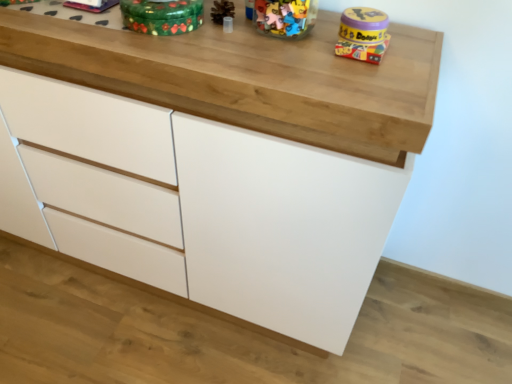
Question: Considering their positions, is green painted wood toy at upper center, acting as the 2th toy starting from the right, located in front of or behind matte yellow plastic toy at upper right, arranged as the 2th toy when viewed from the left?

Choices:
 (A) behind
 (B) front

Answer: (B)

Question: Does point (194, 4) appear closer or farther from the camera than point (359, 41)?

Choices:
 (A) closer
 (B) farther

Answer: (B)

Question: From the image's perspective, is green painted wood toy at upper center, which ranks as the first toy in left-to-right order, positioned above or below matte yellow plastic toy at upper right, the first toy when ordered from right to left?

Choices:
 (A) below
 (B) above

Answer: (B)

Question: Do you think matte yellow plastic toy at upper right, the first toy when ordered from right to left, is within green painted wood toy at upper center, acting as the 2th toy starting from the right, or outside of it?

Choices:
 (A) outside
 (B) inside

Answer: (A)

Question: Looking at their shapes, would you say matte yellow plastic toy at upper right, arranged as the 2th toy when viewed from the left, is wider or thinner than green painted wood toy at upper center, acting as the 2th toy starting from the right?

Choices:
 (A) thin
 (B) wide

Answer: (A)

Question: Does point (357, 23) appear closer or farther from the camera than point (176, 11)?

Choices:
 (A) farther
 (B) closer

Answer: (B)

Question: Considering the positions of matte yellow plastic toy at upper right, arranged as the 2th toy when viewed from the left, and green painted wood toy at upper center, acting as the 2th toy starting from the right, in the image, is matte yellow plastic toy at upper right, arranged as the 2th toy when viewed from the left, taller or shorter than green painted wood toy at upper center, acting as the 2th toy starting from the right,?

Choices:
 (A) short
 (B) tall

Answer: (A)